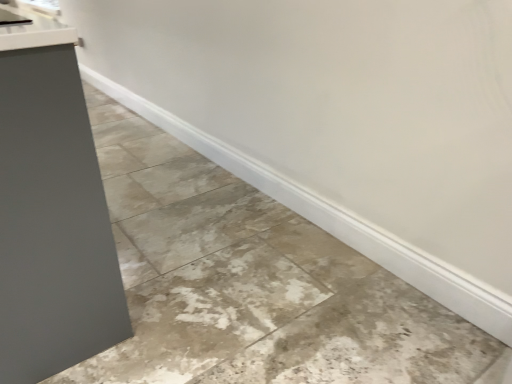
Where is `gray concrete at left`? This screenshot has width=512, height=384. gray concrete at left is located at coordinates (252, 283).

Measure the distance between point (293, 290) and camera.

The distance of point (293, 290) from camera is 1.48 meters.

The image size is (512, 384). Describe the element at coordinates (252, 283) in the screenshot. I see `gray concrete at left` at that location.

At what (x,y) coordinates should I click in order to perform the action: click on gray concrete at left. Please return your answer as a coordinate pair (x, y). The width and height of the screenshot is (512, 384). Looking at the image, I should click on (252, 283).